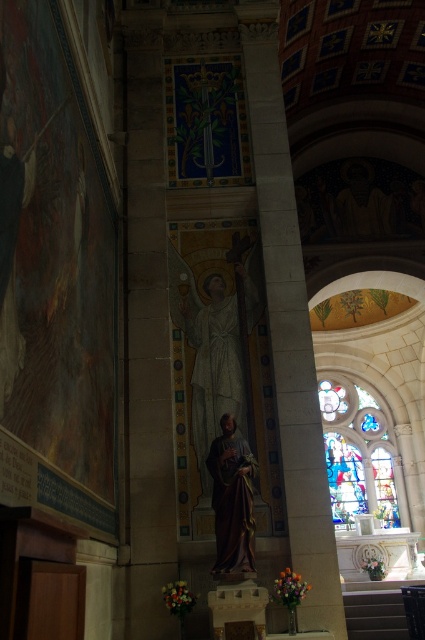
Question: Observing the image, what is the correct spatial positioning of matte white statue at center in reference to golden polished statue at center?

Choices:
 (A) above
 (B) below

Answer: (A)

Question: Based on their relative distances, which object is nearer to the golden polished statue at center?

Choices:
 (A) stained glass window at center
 (B) matte white statue at center

Answer: (B)

Question: Is stained glass window at center positioned in front of golden polished statue at center?

Choices:
 (A) yes
 (B) no

Answer: (B)

Question: Which object is farther from the camera taking this photo?

Choices:
 (A) matte white statue at center
 (B) golden polished statue at center

Answer: (A)

Question: Which object is closer to the camera taking this photo?

Choices:
 (A) golden polished statue at center
 (B) matte white statue at center
 (C) stained glass window at center

Answer: (A)

Question: Is matte white statue at center below stained glass window at center?

Choices:
 (A) yes
 (B) no

Answer: (B)